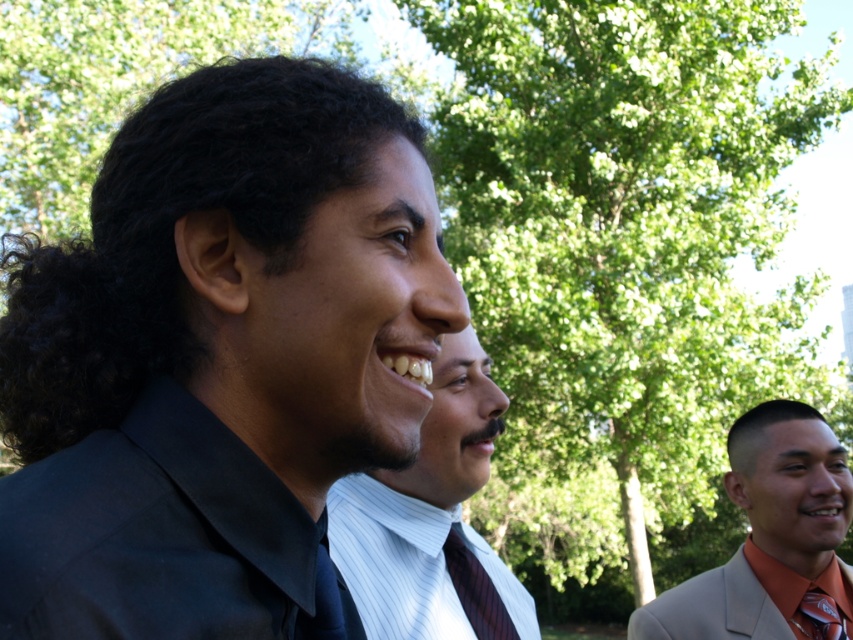
Question: Which point is farther to the camera?

Choices:
 (A) (583, 113)
 (B) (833, 625)
 (C) (155, 573)

Answer: (A)

Question: Which of the following is the closest to the observer?

Choices:
 (A) striped fabric tie at center
 (B) white pinstripe shirt and tie at center

Answer: (B)

Question: Can you confirm if dark blue satin shirt at left is positioned to the right of white pinstripe shirt and tie at center?

Choices:
 (A) yes
 (B) no

Answer: (B)

Question: Can you confirm if dark blue satin shirt at left is positioned below matte black tie at center?

Choices:
 (A) no
 (B) yes

Answer: (A)

Question: Can you confirm if matte black shirt at center is positioned to the left of green leafy tree at center?

Choices:
 (A) yes
 (B) no

Answer: (A)

Question: Which of these objects is positioned farthest from the green leafy tree at center?

Choices:
 (A) dark blue satin shirt at left
 (B) smooth white shirt at center
 (C) light gray suit at lower right

Answer: (A)